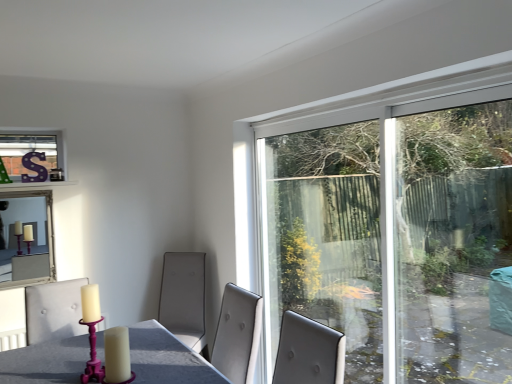
The height and width of the screenshot is (384, 512). In order to click on free space above silver-framed mirror at upper left (from a real-world perspective) in this screenshot , I will do `click(26, 188)`.